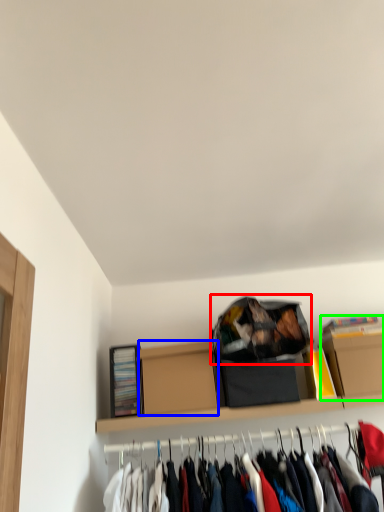
Question: Which object is the farthest from bag (highlighted by a red box)? Choose among these: cardboard box (highlighted by a blue box) or cardboard box (highlighted by a green box).

Choices:
 (A) cardboard box
 (B) cardboard box

Answer: (B)